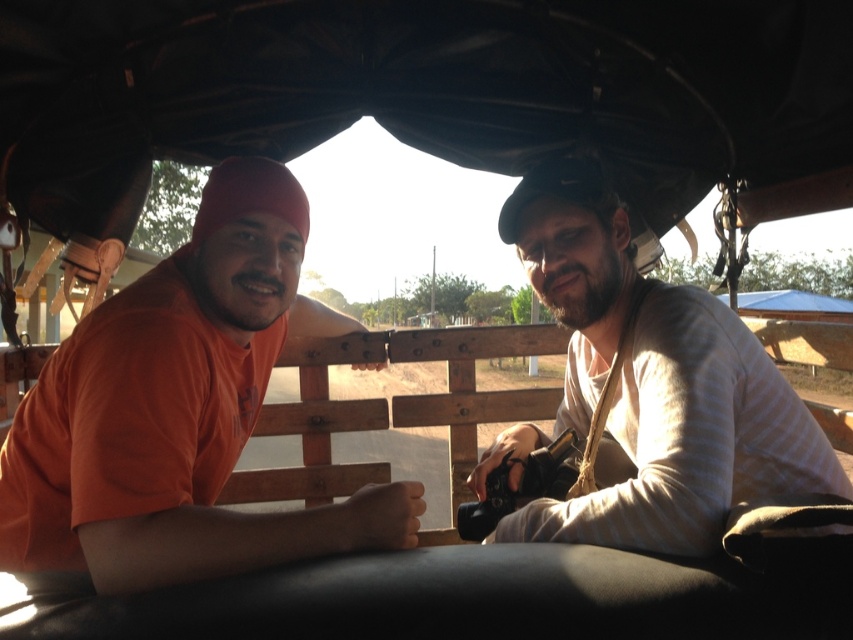
Question: Does orange cotton shirt at left lie in front of beige striped shirt at right?

Choices:
 (A) yes
 (B) no

Answer: (A)

Question: Which object appears closest to the camera in this image?

Choices:
 (A) orange cotton shirt at left
 (B) beige striped shirt at right

Answer: (A)

Question: Is orange cotton shirt at left bigger than beige striped shirt at right?

Choices:
 (A) yes
 (B) no

Answer: (A)

Question: Which point is farther to the camera?

Choices:
 (A) (65, 444)
 (B) (618, 458)

Answer: (B)

Question: Is orange cotton shirt at left below beige striped shirt at right?

Choices:
 (A) yes
 (B) no

Answer: (B)